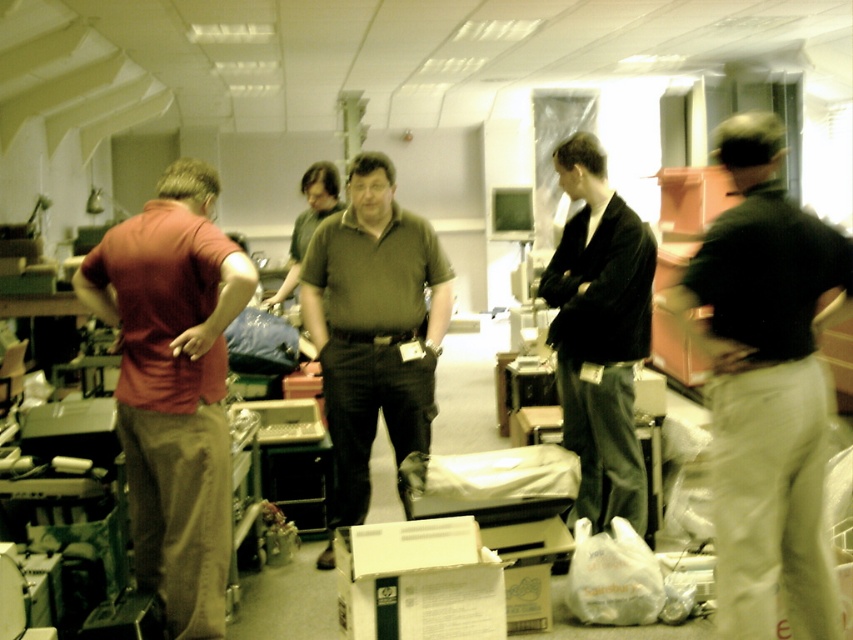
Does black cotton shirt at right have a lesser width compared to white cardboard box at lower center?

Yes, black cotton shirt at right is thinner than white cardboard box at lower center.

Describe the element at coordinates (766, 387) in the screenshot. Image resolution: width=853 pixels, height=640 pixels. I see `black cotton shirt at right` at that location.

Image resolution: width=853 pixels, height=640 pixels. I want to click on black cotton shirt at right, so (x=766, y=387).

Is point (813, 260) less distant than point (138, 308)?

Yes.

Is black cotton shirt at right to the left of matte red shirt at left from the viewer's perspective?

No, black cotton shirt at right is not to the left of matte red shirt at left.

Between point (759, 136) and point (175, 291), which one is positioned in front?

Point (759, 136) is in front.

You are a GUI agent. You are given a task and a screenshot of the screen. Output one action in this format:
    pyautogui.click(x=<x>, y=<y>)
    Task: Click on the black cotton shirt at right
    Image resolution: width=853 pixels, height=640 pixels.
    Given the screenshot: What is the action you would take?
    pyautogui.click(x=766, y=387)

Who is higher up, green matte shirt at center or white cardboard box at lower center?

green matte shirt at center

Can you confirm if green matte shirt at center is positioned below white cardboard box at lower center?

No.

Between point (318, 282) and point (454, 630), which one is positioned behind?

The point (318, 282) is behind.

Locate an element on the screen. This screenshot has width=853, height=640. green matte shirt at center is located at coordinates (374, 324).